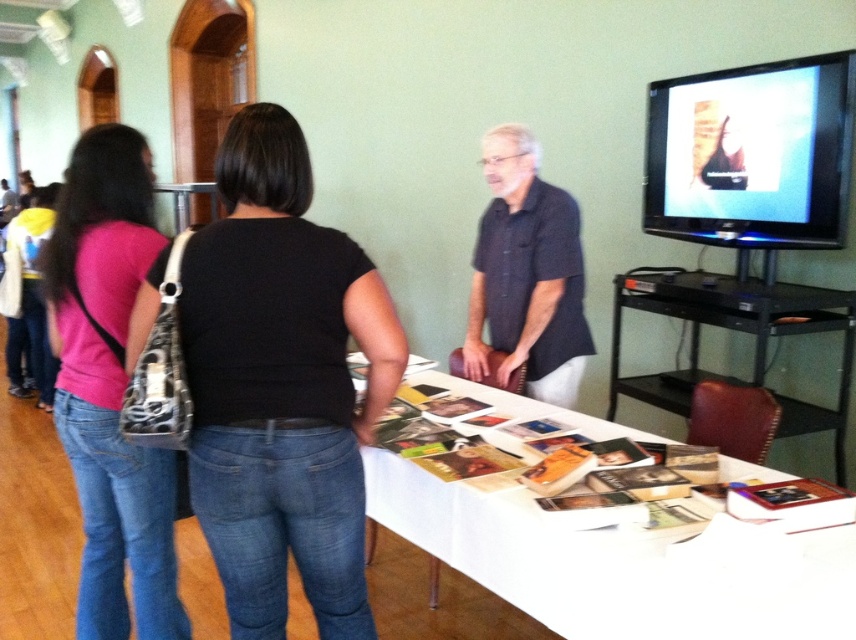
Question: Among these points, which one is farthest from the camera?

Choices:
 (A) (116, 470)
 (B) (638, 621)

Answer: (A)

Question: Is black denim jeans at lower left further to the viewer compared to pink fabric purse at left?

Choices:
 (A) no
 (B) yes

Answer: (A)

Question: Does black denim jeans at lower left have a larger size compared to dark blue shirt at center?

Choices:
 (A) no
 (B) yes

Answer: (A)

Question: Among these points, which one is nearest to the camera?

Choices:
 (A) (525, 509)
 (B) (288, 285)
 (C) (117, 451)

Answer: (B)

Question: Is white paper at center to the right of pink fabric purse at left from the viewer's perspective?

Choices:
 (A) yes
 (B) no

Answer: (A)

Question: Among these objects, which one is nearest to the camera?

Choices:
 (A) white paper at center
 (B) dark blue shirt at center
 (C) black denim jeans at lower left
 (D) pink fabric purse at left

Answer: (A)